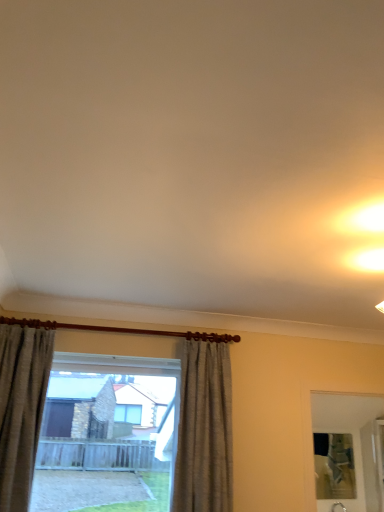
Describe the element at coordinates (204, 429) in the screenshot. I see `clear glass window at center` at that location.

I want to click on gray fabric curtain at center, placed as the 1th curtain when sorted from right to left, so click(x=204, y=430).

From a real-world perspective, does gray fabric curtain at center, the 2th curtain positioned from the left, sit lower than textured beige curtain at left, which ranks as the 2th curtain in right-to-left order?

Yes, from a real-world perspective, gray fabric curtain at center, the 2th curtain positioned from the left, is beneath textured beige curtain at left, which ranks as the 2th curtain in right-to-left order.

In the image, is gray fabric curtain at center, the 2th curtain positioned from the left, on the left side or the right side of textured beige curtain at left, which ranks as the 2th curtain in right-to-left order?

Clearly, gray fabric curtain at center, the 2th curtain positioned from the left, is on the right of textured beige curtain at left, which ranks as the 2th curtain in right-to-left order, in the image.

How different are the orientations of clear glass window at center and textured beige curtain at left, which ranks as the 2th curtain in right-to-left order, in degrees?

The angle between the facing direction of clear glass window at center and the facing direction of textured beige curtain at left, which ranks as the 2th curtain in right-to-left order, is 2.83 degrees.

Where is `curtain that is the 2nd one when counting forward from the clear glass window at center`? curtain that is the 2nd one when counting forward from the clear glass window at center is located at coordinates (21, 408).

Would you say clear glass window at center is to the left or to the right of textured beige curtain at left, positioned as the 1th curtain in left-to-right order, in the picture?

From the image, it's evident that clear glass window at center is to the right of textured beige curtain at left, positioned as the 1th curtain in left-to-right order.

Is clear glass window at center shorter than textured beige curtain at left, positioned as the 1th curtain in left-to-right order?

Yes, clear glass window at center is shorter than textured beige curtain at left, positioned as the 1th curtain in left-to-right order.

In the scene shown: Which object is further away from the camera taking this photo, textured beige curtain at left, positioned as the 1th curtain in left-to-right order, or clear glass window at center?

clear glass window at center is further from the camera.

From a real-world perspective, which is physically above, textured beige curtain at left, positioned as the 1th curtain in left-to-right order, or clear glass window at center?

textured beige curtain at left, positioned as the 1th curtain in left-to-right order, is physically above.

Considering the positions of point (2, 402) and point (212, 340), is point (2, 402) closer or farther from the camera than point (212, 340)?

Point (2, 402) appears to be closer to the viewer than point (212, 340).

From the image's perspective, would you say textured beige curtain at left, positioned as the 1th curtain in left-to-right order, is positioned over clear glass window at center?

Yes.

Based on their sizes in the image, would you say textured beige curtain at left, positioned as the 1th curtain in left-to-right order, is bigger or smaller than gray fabric curtain at center, the 2th curtain positioned from the left?

Clearly, textured beige curtain at left, positioned as the 1th curtain in left-to-right order, is smaller in size than gray fabric curtain at center, the 2th curtain positioned from the left.

Is textured beige curtain at left, positioned as the 1th curtain in left-to-right order, next to gray fabric curtain at center, the 2th curtain positioned from the left?

There is a gap between textured beige curtain at left, positioned as the 1th curtain in left-to-right order, and gray fabric curtain at center, the 2th curtain positioned from the left.

From the picture: Can you tell me how much textured beige curtain at left, which ranks as the 2th curtain in right-to-left order, and gray fabric curtain at center, placed as the 1th curtain when sorted from right to left, differ in facing direction?

The angle between the facing direction of textured beige curtain at left, which ranks as the 2th curtain in right-to-left order, and the facing direction of gray fabric curtain at center, placed as the 1th curtain when sorted from right to left, is 0.000331 degrees.

Which object is closer to the camera taking this photo, textured beige curtain at left, positioned as the 1th curtain in left-to-right order, or gray fabric curtain at center, placed as the 1th curtain when sorted from right to left?

textured beige curtain at left, positioned as the 1th curtain in left-to-right order.

From the picture: Would you say clear glass window at center is outside gray fabric curtain at center, placed as the 1th curtain when sorted from right to left?

Absolutely, clear glass window at center is external to gray fabric curtain at center, placed as the 1th curtain when sorted from right to left.

Is clear glass window at center not near gray fabric curtain at center, the 2th curtain positioned from the left?

That's not correct — clear glass window at center is a little close to gray fabric curtain at center, the 2th curtain positioned from the left.

Considering the sizes of objects clear glass window at center and gray fabric curtain at center, the 2th curtain positioned from the left, in the image provided, who is shorter, clear glass window at center or gray fabric curtain at center, the 2th curtain positioned from the left,?

clear glass window at center is shorter.

Find the location of a particular element. This screenshot has height=512, width=384. window behind the gray fabric curtain at center, placed as the 1th curtain when sorted from right to left is located at coordinates (204, 429).

Locate an element on the screen. window lying below the gray fabric curtain at center, placed as the 1th curtain when sorted from right to left (from the image's perspective) is located at coordinates (204, 429).

Can you tell me how much gray fabric curtain at center, the 2th curtain positioned from the left, and clear glass window at center differ in facing direction?

They differ by 2.83 degrees in their facing directions.

Considering the sizes of objects gray fabric curtain at center, the 2th curtain positioned from the left, and clear glass window at center in the image provided, who is taller, gray fabric curtain at center, the 2th curtain positioned from the left, or clear glass window at center?

gray fabric curtain at center, the 2th curtain positioned from the left, is taller.

Can clear glass window at center be found inside gray fabric curtain at center, the 2th curtain positioned from the left?

That's incorrect, clear glass window at center is not inside gray fabric curtain at center, the 2th curtain positioned from the left.

Where is `curtain on the left of gray fabric curtain at center, placed as the 1th curtain when sorted from right to left`? curtain on the left of gray fabric curtain at center, placed as the 1th curtain when sorted from right to left is located at coordinates (21, 408).

Starting from the clear glass window at center, which curtain is the 2nd one in front? Please provide its 2D coordinates.

[(21, 408)]

In the scene shown: When comparing their distances from clear glass window at center, does gray fabric curtain at center, placed as the 1th curtain when sorted from right to left, or textured beige curtain at left, positioned as the 1th curtain in left-to-right order, seem further?

textured beige curtain at left, positioned as the 1th curtain in left-to-right order, is further to clear glass window at center.

Which object lies further to the anchor point gray fabric curtain at center, the 2th curtain positioned from the left, textured beige curtain at left, which ranks as the 2th curtain in right-to-left order, or clear glass window at center?

textured beige curtain at left, which ranks as the 2th curtain in right-to-left order, is further to gray fabric curtain at center, the 2th curtain positioned from the left.

Based on their spatial positions, is gray fabric curtain at center, placed as the 1th curtain when sorted from right to left, or clear glass window at center closer to textured beige curtain at left, positioned as the 1th curtain in left-to-right order?

Based on the image, clear glass window at center appears to be nearer to textured beige curtain at left, positioned as the 1th curtain in left-to-right order.

Considering their positions, is textured beige curtain at left, positioned as the 1th curtain in left-to-right order, positioned closer to clear glass window at center than gray fabric curtain at center, placed as the 1th curtain when sorted from right to left?

gray fabric curtain at center, placed as the 1th curtain when sorted from right to left.

Considering their positions, is clear glass window at center positioned closer to gray fabric curtain at center, placed as the 1th curtain when sorted from right to left, than textured beige curtain at left, positioned as the 1th curtain in left-to-right order?

clear glass window at center.

Which object lies nearer to the anchor point textured beige curtain at left, positioned as the 1th curtain in left-to-right order, clear glass window at center or gray fabric curtain at center, placed as the 1th curtain when sorted from right to left?

clear glass window at center is closer to textured beige curtain at left, positioned as the 1th curtain in left-to-right order.

Locate an element on the screen. window between textured beige curtain at left, which ranks as the 2th curtain in right-to-left order, and gray fabric curtain at center, the 2th curtain positioned from the left, from left to right is located at coordinates (204, 429).